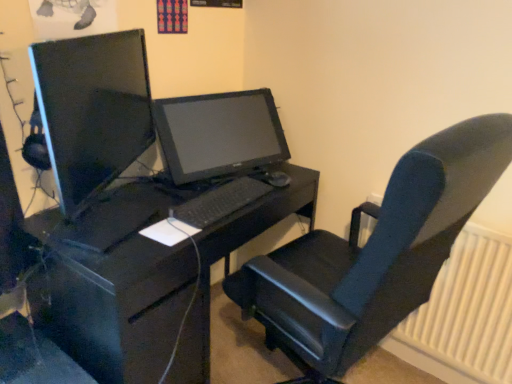
Question: Is point (138, 365) positioned closer to the camera than point (91, 183)?

Choices:
 (A) farther
 (B) closer

Answer: (A)

Question: From a real-world perspective, is black matte desk at center positioned above or below matte black monitor at left?

Choices:
 (A) below
 (B) above

Answer: (A)

Question: Which is nearer to the black plastic mouse at center?

Choices:
 (A) velvet-like black chair at center
 (B) matte black monitor at left
 (C) black matte desk at center
 (D) black matte keyboard at center
 (E) white plastic radiator at right

Answer: (D)

Question: Estimate the real-world distances between objects in this image. Which object is farther from the black matte desk at center?

Choices:
 (A) velvet-like black chair at center
 (B) matte black monitor at left
 (C) black plastic mouse at center
 (D) black matte keyboard at center
 (E) white plastic radiator at right

Answer: (E)